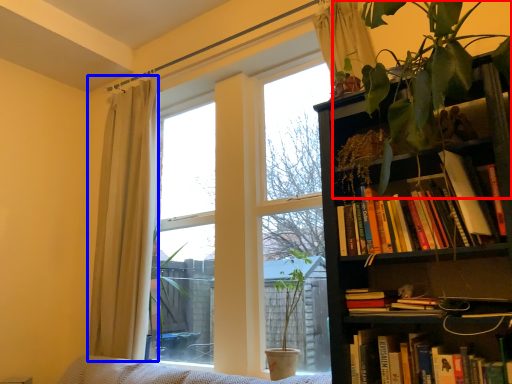
Question: Which object appears closest to the camera in this image, vegetation (highlighted by a red box) or curtain (highlighted by a blue box)?

Choices:
 (A) vegetation
 (B) curtain

Answer: (A)